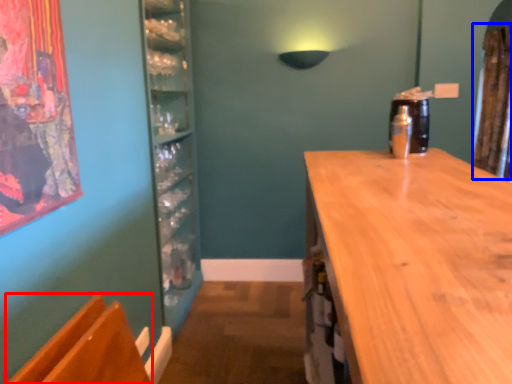
Question: Which point is closer to the camera, armchair (highlighted by a red box) or curtain (highlighted by a blue box)?

Choices:
 (A) armchair
 (B) curtain

Answer: (A)